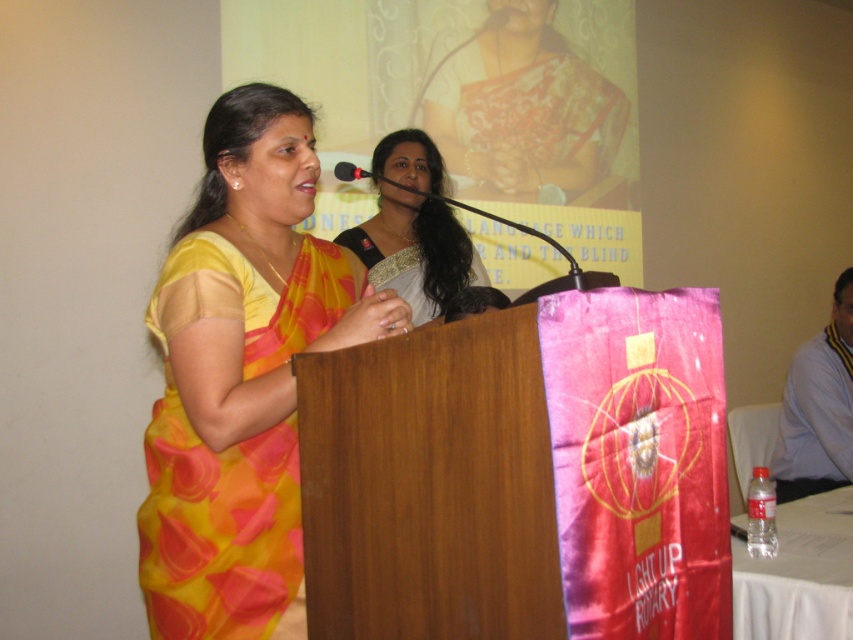
Question: Which object is closer to the camera taking this photo?

Choices:
 (A) black plastic microphone at center
 (B) silky white saree at center
 (C) yellow silk saree at center

Answer: (C)

Question: Which object is the farthest from the silky white saree at center?

Choices:
 (A) black plastic microphone at center
 (B) yellow silk saree at center

Answer: (B)

Question: Can you confirm if silky white saree at center is wider than black plastic microphone at center?

Choices:
 (A) yes
 (B) no

Answer: (A)

Question: Is silky white saree at center above black plastic microphone at center?

Choices:
 (A) yes
 (B) no

Answer: (A)

Question: Which object appears closest to the camera in this image?

Choices:
 (A) yellow silk saree at center
 (B) silky white saree at center

Answer: (A)

Question: Observing the image, what is the correct spatial positioning of silky white saree at center in reference to black plastic microphone at center?

Choices:
 (A) below
 (B) above

Answer: (B)